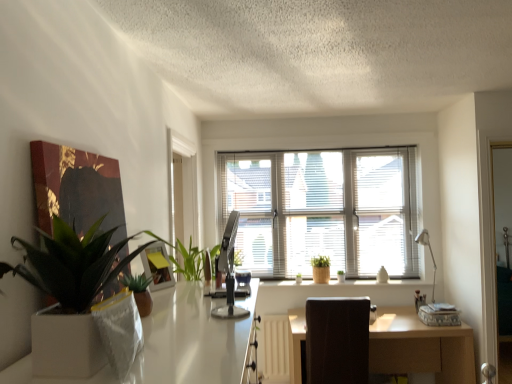
Question: Does brown fabric swivel chair at center appear on the left side of white blinds at center?

Choices:
 (A) no
 (B) yes

Answer: (A)

Question: Considering the relative sizes of brown fabric swivel chair at center and white blinds at center in the image provided, is brown fabric swivel chair at center bigger than white blinds at center?

Choices:
 (A) yes
 (B) no

Answer: (A)

Question: Can you confirm if brown fabric swivel chair at center is shorter than white blinds at center?

Choices:
 (A) no
 (B) yes

Answer: (B)

Question: Is brown fabric swivel chair at center thinner than white blinds at center?

Choices:
 (A) yes
 (B) no

Answer: (B)

Question: From the image's perspective, would you say brown fabric swivel chair at center is shown under white blinds at center?

Choices:
 (A) yes
 (B) no

Answer: (A)

Question: Is brown fabric swivel chair at center turned away from white blinds at center?

Choices:
 (A) yes
 (B) no

Answer: (B)

Question: From the image's perspective, is green matte plant at left, the first houseplant in the left-to-right sequence, below light brown wooden desk at center?

Choices:
 (A) no
 (B) yes

Answer: (A)

Question: Is light brown wooden desk at center located within green matte plant at left, the 2th houseplant from the back?

Choices:
 (A) no
 (B) yes

Answer: (A)

Question: From the image's perspective, is green matte plant at left, which is the 1th houseplant from top to bottom, located above light brown wooden desk at center?

Choices:
 (A) no
 (B) yes

Answer: (B)

Question: Is green matte plant at left, the 2th houseplant from the back, not inside light brown wooden desk at center?

Choices:
 (A) no
 (B) yes

Answer: (B)

Question: Does green matte plant at left, positioned as the 2th houseplant in right-to-left order, have a larger size compared to light brown wooden desk at center?

Choices:
 (A) no
 (B) yes

Answer: (A)

Question: From a real-world perspective, is green matte plant at left, which is counted as the 1th houseplant, starting from the front, positioned over light brown wooden desk at center based on gravity?

Choices:
 (A) yes
 (B) no

Answer: (A)

Question: Does yellow paper picture frame at upper center lie in front of brown fabric swivel chair at center?

Choices:
 (A) yes
 (B) no

Answer: (A)